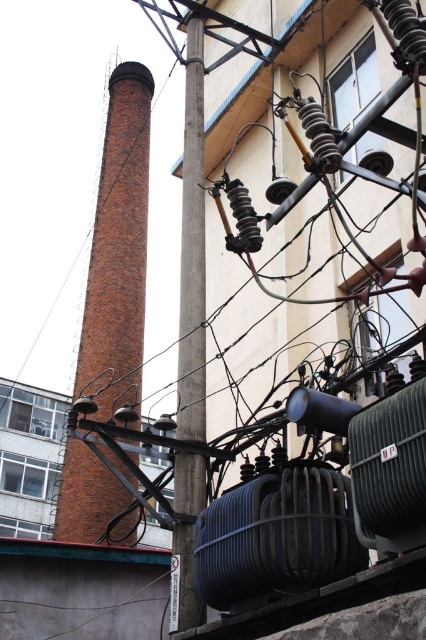
Can you confirm if red brick chimney at left is positioned above smooth gray pole at center?

Yes, red brick chimney at left is above smooth gray pole at center.

Is red brick chimney at left to the right of smooth gray pole at center from the viewer's perspective?

Incorrect, red brick chimney at left is not on the right side of smooth gray pole at center.

Is point (92, 525) positioned behind point (189, 388)?

Yes, it is behind point (189, 388).

You are a GUI agent. You are given a task and a screenshot of the screen. Output one action in this format:
    pyautogui.click(x=<x>, y=<y>)
    Task: Click on the red brick chimney at left
    This screenshot has height=640, width=426.
    Given the screenshot: What is the action you would take?
    pyautogui.click(x=118, y=244)